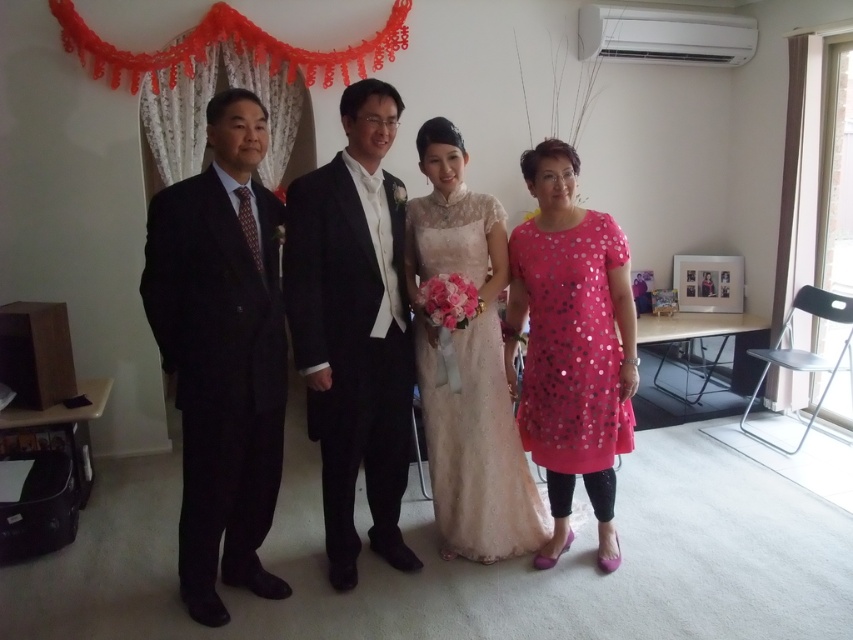
You are at the center of the image and want to move towards the pink sequined dress at right. Which direction should you move?

You should move to the right to reach the pink sequined dress at right since it is located at point (572, 346), which is to the right of the center.

You are at a wedding and see two men standing in front of you. The dark suit at left and the shiny black suit at center. Which one is positioned to the left of the other?

The dark suit at left is positioned to the left of the shiny black suit at center.